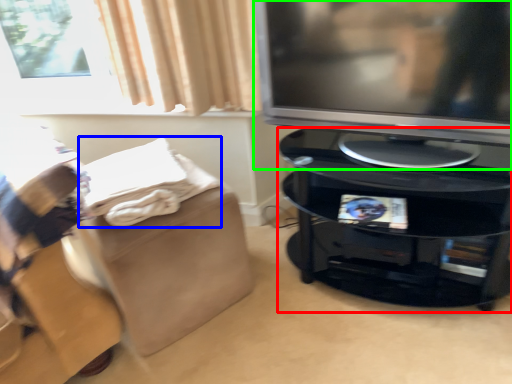
Question: Estimate the real-world distances between objects in this image. Which object is closer to furniture (highlighted by a red box), blanket (highlighted by a blue box) or television (highlighted by a green box)?

Choices:
 (A) blanket
 (B) television

Answer: (B)